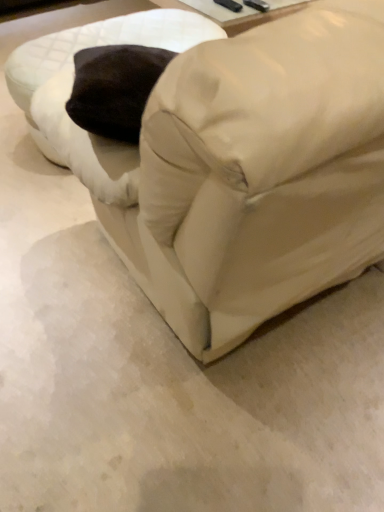
Question: From the image's perspective, is white fabric swivel chair at upper left positioned above or below matte white couch at center?

Choices:
 (A) below
 (B) above

Answer: (B)

Question: Is point (51, 133) positioned closer to the camera than point (183, 240)?

Choices:
 (A) closer
 (B) farther

Answer: (B)

Question: Is white fabric swivel chair at upper left taller or shorter than matte white couch at center?

Choices:
 (A) short
 (B) tall

Answer: (A)

Question: In terms of width, does matte white couch at center look wider or thinner when compared to white fabric swivel chair at upper left?

Choices:
 (A) thin
 (B) wide

Answer: (B)

Question: Visually, is matte white couch at center positioned to the left or to the right of white fabric swivel chair at upper left?

Choices:
 (A) right
 (B) left

Answer: (A)

Question: Considering the positions of matte white couch at center and white fabric swivel chair at upper left in the image, is matte white couch at center bigger or smaller than white fabric swivel chair at upper left?

Choices:
 (A) small
 (B) big

Answer: (B)

Question: From a real-world perspective, relative to white fabric swivel chair at upper left, is matte white couch at center vertically above or below?

Choices:
 (A) below
 (B) above

Answer: (B)